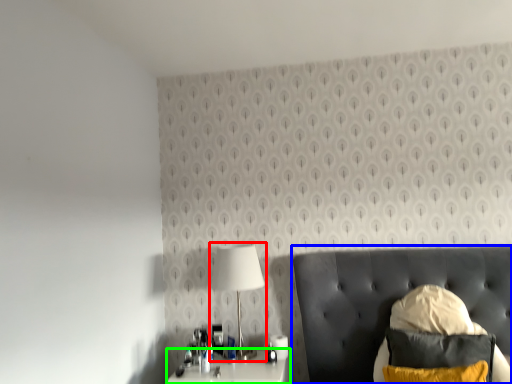
Question: Estimate the real-world distances between objects in this image. Which object is farther from lamp (highlighted by a red box), furniture (highlighted by a blue box) or nightstand (highlighted by a green box)?

Choices:
 (A) furniture
 (B) nightstand

Answer: (A)